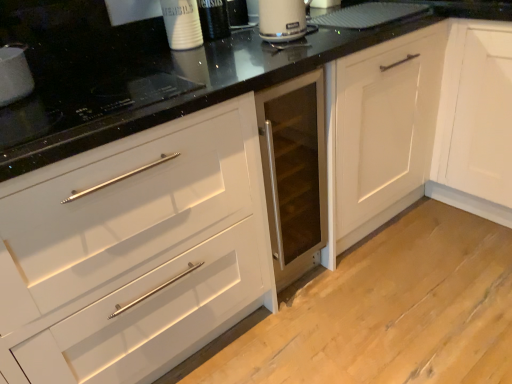
Question: Is black glass cooktop at upper left, which appears as the first appliance when viewed from the right, inside or outside of matte black induction cooktop at upper left, placed as the first appliance when sorted from left to right?

Choices:
 (A) inside
 (B) outside

Answer: (B)

Question: Based on their sizes in the image, would you say black glass cooktop at upper left, marked as the second appliance in a left-to-right arrangement, is bigger or smaller than matte black induction cooktop at upper left, placed as the first appliance when sorted from left to right?

Choices:
 (A) small
 (B) big

Answer: (B)

Question: Estimate the real-world distances between objects in this image. Which object is closer to the matte white kettle at upper center?

Choices:
 (A) matte black induction cooktop at upper left, marked as the second appliance in a right-to-left arrangement
 (B) white matte cabinet at center
 (C) black glass cooktop at upper left, which appears as the first appliance when viewed from the right

Answer: (B)

Question: Based on their relative distances, which object is farther from the black glass cooktop at upper left, marked as the second appliance in a left-to-right arrangement?

Choices:
 (A) matte black induction cooktop at upper left, marked as the second appliance in a right-to-left arrangement
 (B) matte white kettle at upper center
 (C) white matte cabinet at center

Answer: (C)